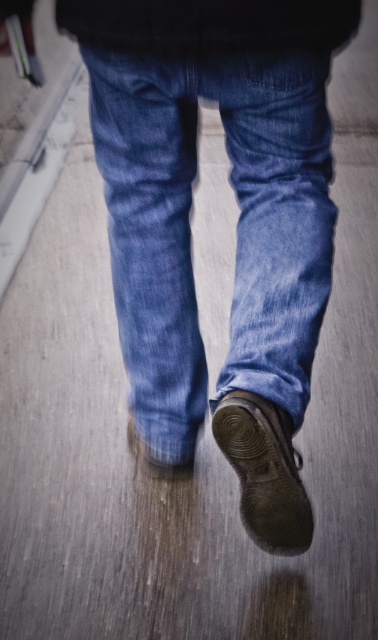
You are a fashion designer analyzing the image. You need to determine which item of clothing takes up more visual space in the composition. Which one is larger between the denim jeans at center and the matte brown leather shoe at lower center?

The denim jeans at center is larger in size than the matte brown leather shoe at lower center, so the denim jeans at center takes up more visual space in the composition.

You are a photographer focusing on the details of shoes. In the image, you see the leather textured shoe at lower center and the matte brown leather shoe at lower center. Which shoe is positioned to the right side?

The leather textured shoe at lower center is positioned to the right of the matte brown leather shoe at lower center.

You are a fashion designer observing the denim jeans at center and the leather textured shoe at lower center. You need to ensure the jeans and shoes are displayed together in a catalog photo. Given the current spacing between them, can you fit a 10 inch wide accessory between them without moving the jeans or shoes?

The distance between the denim jeans at center and the leather textured shoe at lower center is 11.32 inches. Since the accessory is 10 inches wide, there is enough space to fit it between them without moving the jeans or shoes.